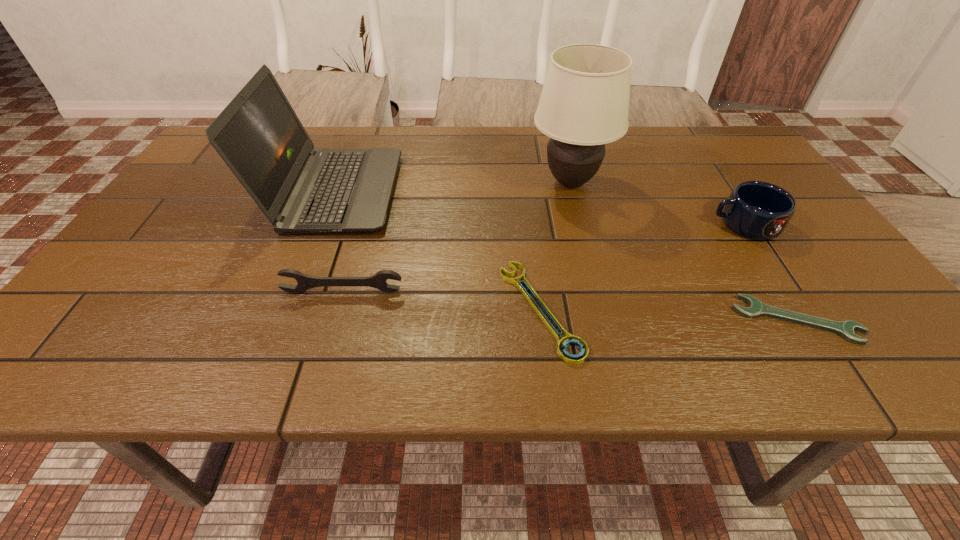
Locate an element on the screen. The image size is (960, 540). lampshade is located at coordinates (584, 104).

Image resolution: width=960 pixels, height=540 pixels. What are the coordinates of `the fifth shortest object` in the screenshot? It's located at (258, 135).

Locate an element on the screen. Image resolution: width=960 pixels, height=540 pixels. mug is located at coordinates (757, 210).

What are the coordinates of `the leftmost wrench` in the screenshot? It's located at (305, 282).

At what (x,y) coordinates should I click in order to perform the action: click on the third shortest object. Please return your answer as a coordinate pair (x, y). Looking at the image, I should click on (305, 282).

Locate an element on the screen. the rightmost wrench is located at coordinates (756, 308).

Where is `the second wrench from left to right`? The height and width of the screenshot is (540, 960). the second wrench from left to right is located at coordinates (570, 339).

Where is `free location located 0.230m on the right of the tallest object`? The width and height of the screenshot is (960, 540). free location located 0.230m on the right of the tallest object is located at coordinates (698, 182).

Where is `vacant space located on the screen of the laptop_computer`? vacant space located on the screen of the laptop_computer is located at coordinates (532, 192).

In order to click on free spot located 0.380m with the handle on the side of the mug in this screenshot , I will do `click(553, 224)`.